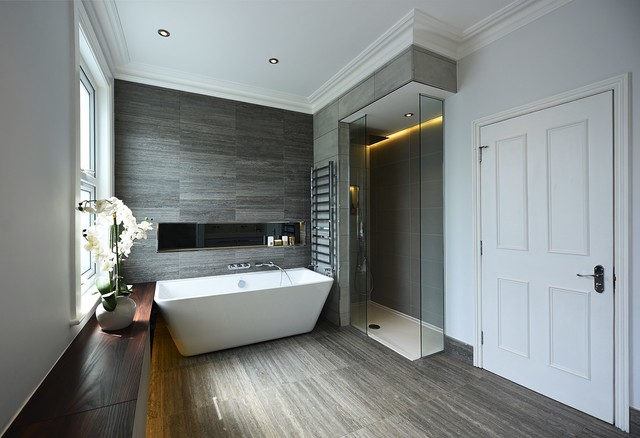
Where is `floor of shower`? The width and height of the screenshot is (640, 438). floor of shower is located at coordinates (394, 332).